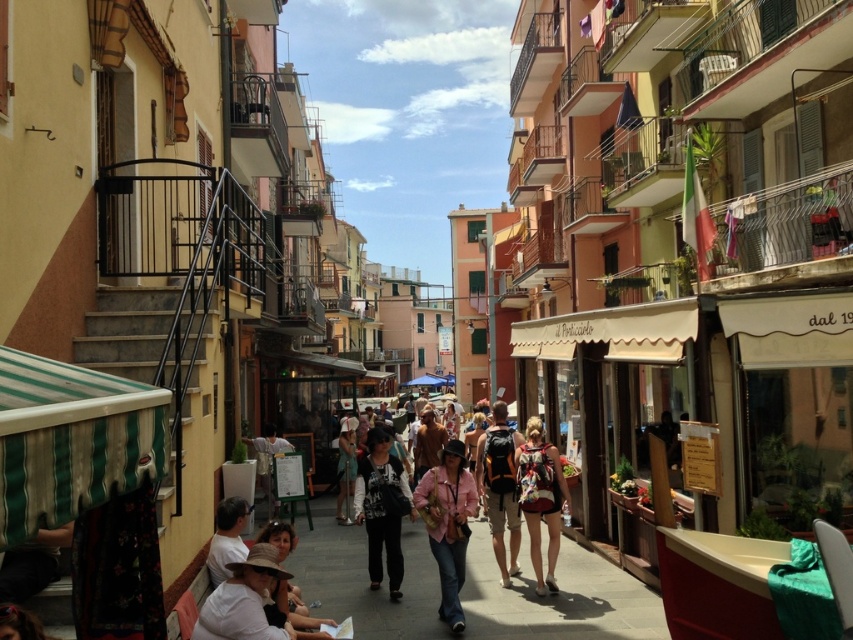
Question: Which object is positioned closest to the orange fabric backpack at center?

Choices:
 (A) smooth concrete pavement at center
 (B) light brown leather jacket at center
 (C) red backpack at center

Answer: (C)

Question: Which object appears closest to the camera in this image?

Choices:
 (A) orange fabric backpack at center
 (B) red backpack at center

Answer: (B)

Question: Does pink fabric jacket at center have a lesser width compared to matte brown hat at lower left?

Choices:
 (A) no
 (B) yes

Answer: (A)

Question: Does dark gray fabric pants at center appear over orange fabric backpack at center?

Choices:
 (A) no
 (B) yes

Answer: (B)

Question: In this image, where is matte brown hat at lower left located relative to denim jacket at center?

Choices:
 (A) above
 (B) below

Answer: (A)

Question: Which of the following is the farthest from the observer?

Choices:
 (A) smooth concrete pavement at center
 (B) orange fabric backpack at center
 (C) matte brown hat at lower left
 (D) dark gray fabric pants at center

Answer: (B)